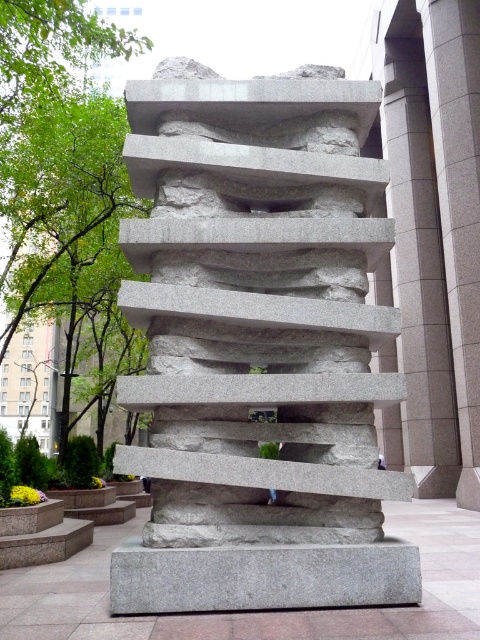
Question: Considering the relative positions of gray granite sculpture at center and gray granite base at center in the image provided, where is gray granite sculpture at center located with respect to gray granite base at center?

Choices:
 (A) left
 (B) right

Answer: (A)

Question: Can you confirm if gray granite sculpture at center is positioned below gray granite base at center?

Choices:
 (A) no
 (B) yes

Answer: (A)

Question: Does gray granite sculpture at center have a lesser width compared to gray granite base at center?

Choices:
 (A) no
 (B) yes

Answer: (A)

Question: Which point is closer to the camera?

Choices:
 (A) (190, 493)
 (B) (204, 561)

Answer: (B)